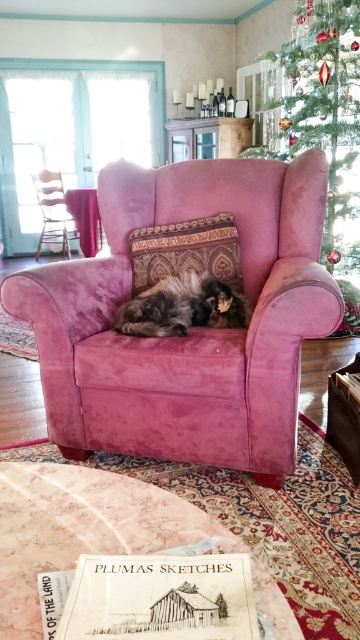
Question: Is green velvet christmas tree at upper right behind wooden chair at left?

Choices:
 (A) yes
 (B) no

Answer: (B)

Question: Estimate the real-world distances between objects in this image. Which object is farther from the fuzzy brown cat at center?

Choices:
 (A) wooden chair at left
 (B) green velvet christmas tree at upper right

Answer: (A)

Question: Which object appears closest to the camera in this image?

Choices:
 (A) wooden chair at left
 (B) green velvet christmas tree at upper right

Answer: (B)

Question: Observing the image, what is the correct spatial positioning of fuzzy brown cat at center in reference to wooden chair at left?

Choices:
 (A) left
 (B) right

Answer: (B)

Question: Considering the real-world distances, which object is closest to the wooden chair at left?

Choices:
 (A) fuzzy brown cat at center
 (B) velvet pink armchair at center

Answer: (B)

Question: Can you confirm if green velvet christmas tree at upper right is bigger than fuzzy brown cat at center?

Choices:
 (A) yes
 (B) no

Answer: (A)